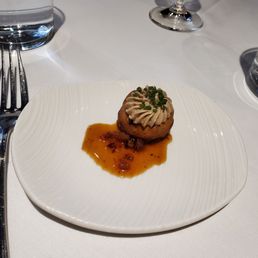
The width and height of the screenshot is (258, 258). What are the coordinates of `table cloth` in the screenshot? It's located at (114, 43).